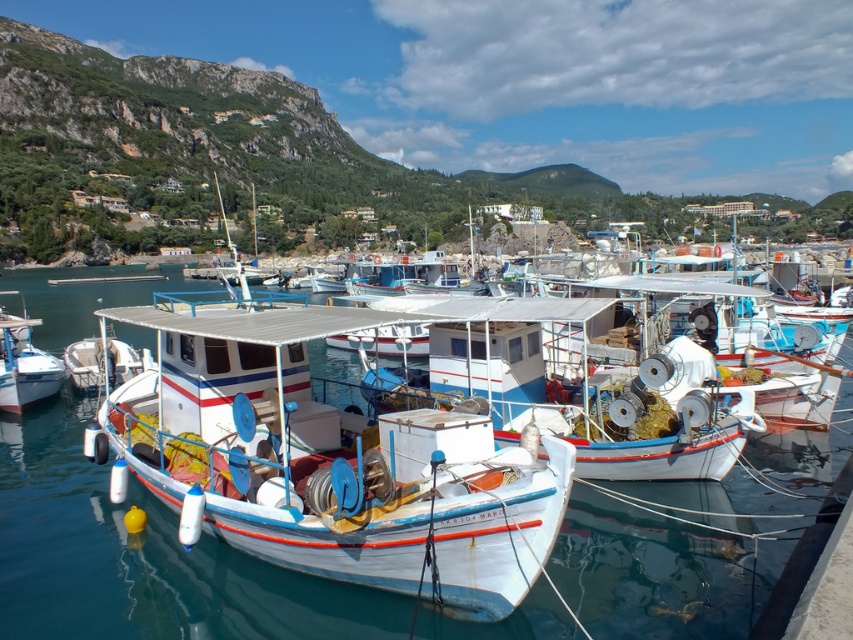
You are a sailor who wants to check the water level under your boat. You are currently on the white glossy boat at left. Can you see the transparent blue water at center from your current position?

The transparent blue water at center is positioned under the white glossy boat at left, so yes, you can see the transparent blue water at center from your current position on the white glossy boat at left.